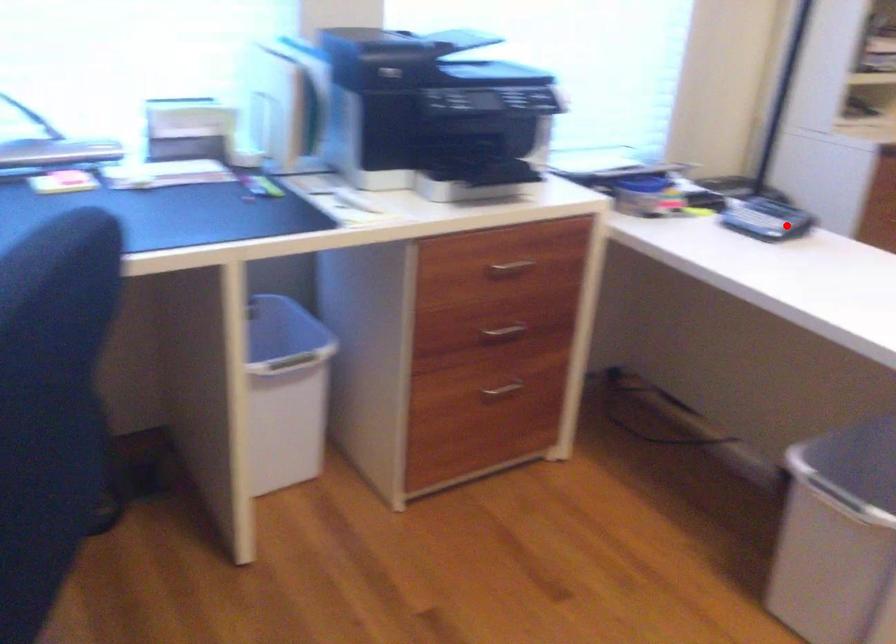
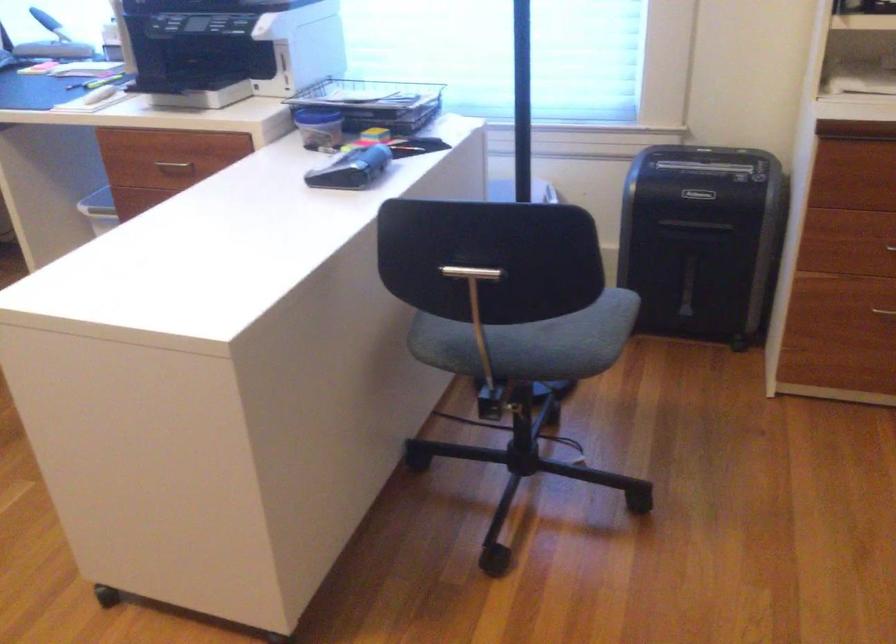
Where in the second image is the point corresponding to the highlighted location from the first image?

(351, 169)